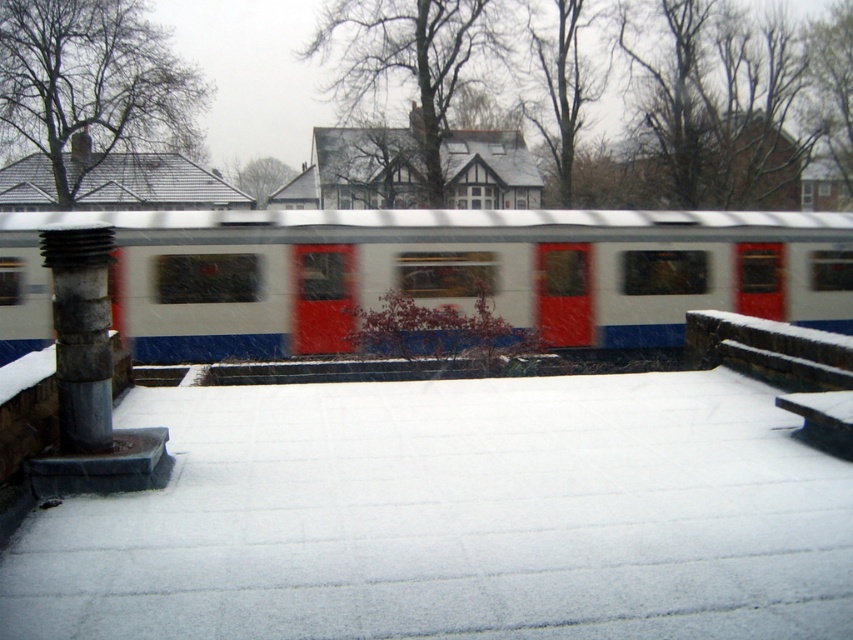
Question: Can you confirm if white glossy train at center is positioned to the left of rusty metallic column at left?

Choices:
 (A) yes
 (B) no

Answer: (B)

Question: Which point is closer to the camera taking this photo?

Choices:
 (A) (32, 332)
 (B) (83, 317)

Answer: (B)

Question: Is white glossy train at center thinner than rusty metallic column at left?

Choices:
 (A) yes
 (B) no

Answer: (B)

Question: Does white glossy train at center appear over rusty metallic column at left?

Choices:
 (A) yes
 (B) no

Answer: (A)